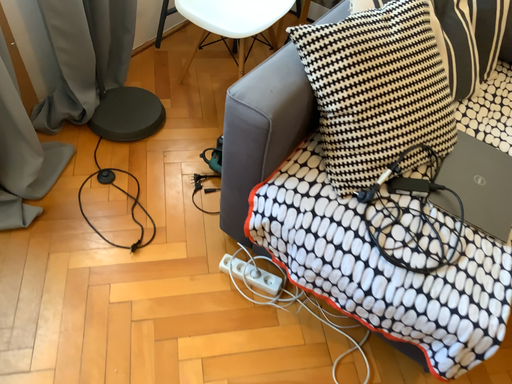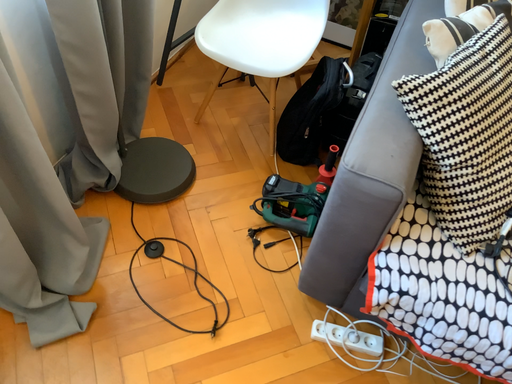
Question: How did the camera likely rotate when shooting the video?

Choices:
 (A) rotated left
 (B) rotated right

Answer: (B)